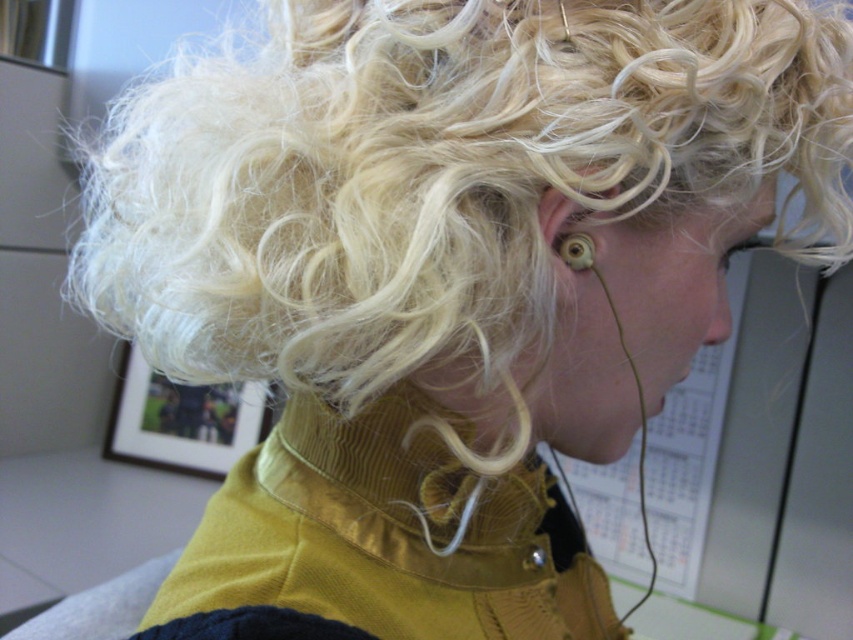
You are a fashion designer observing the person in the image. You need to determine the layering order of the yellow cord at center and the gold metallic earring at ear for a design sketch. Which object is placed lower in the image?

The yellow cord at center is positioned under the gold metallic earring at ear, meaning it is lower in the image.

You are a fashion designer analyzing the image. You need to determine the layering order of the yellow cord at center and the gold metallic earring at ear. Which object is positioned in front?

The yellow cord at center is in front of the gold metallic earring at ear, so the yellow cord at center is positioned in front.

You are a fashion designer observing the person in the image. You need to determine which accessory takes up more vertical space on their outfit. Which one is taller between the yellow cord at center and the gold metallic earring at ear?

The yellow cord at center has a greater height compared to the gold metallic earring at ear, so the yellow cord at center is taller.